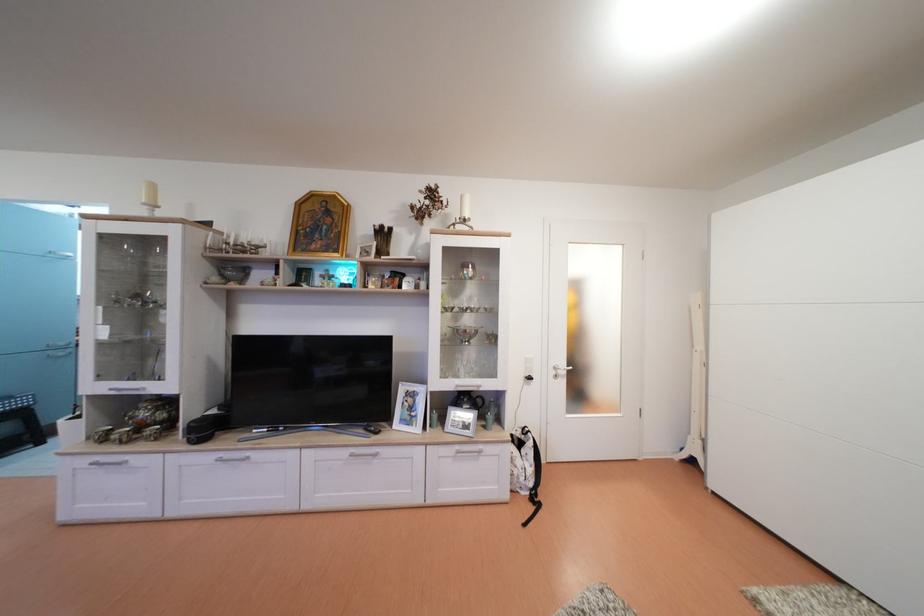
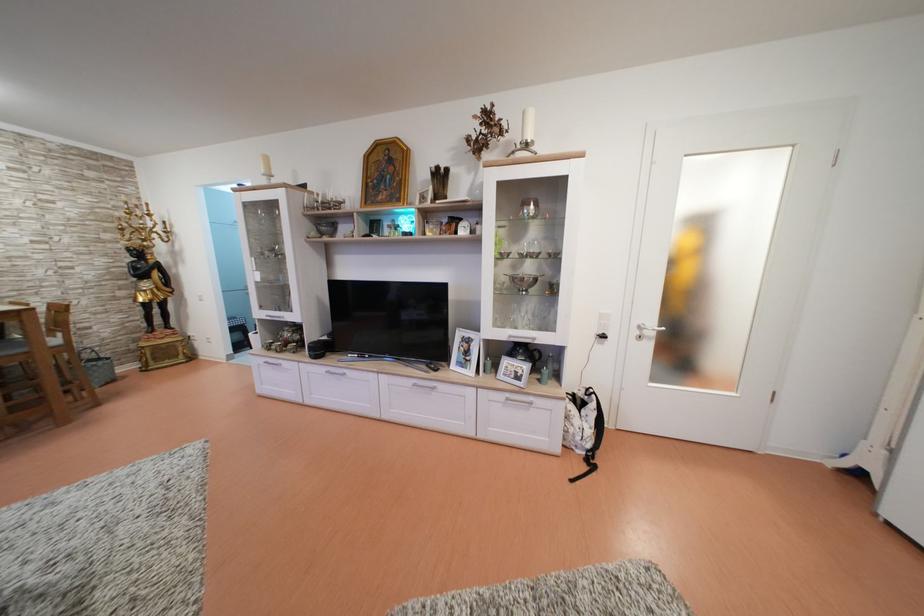
In the second image, find the point that corresponds to point 372,435 in the first image.

(434, 371)